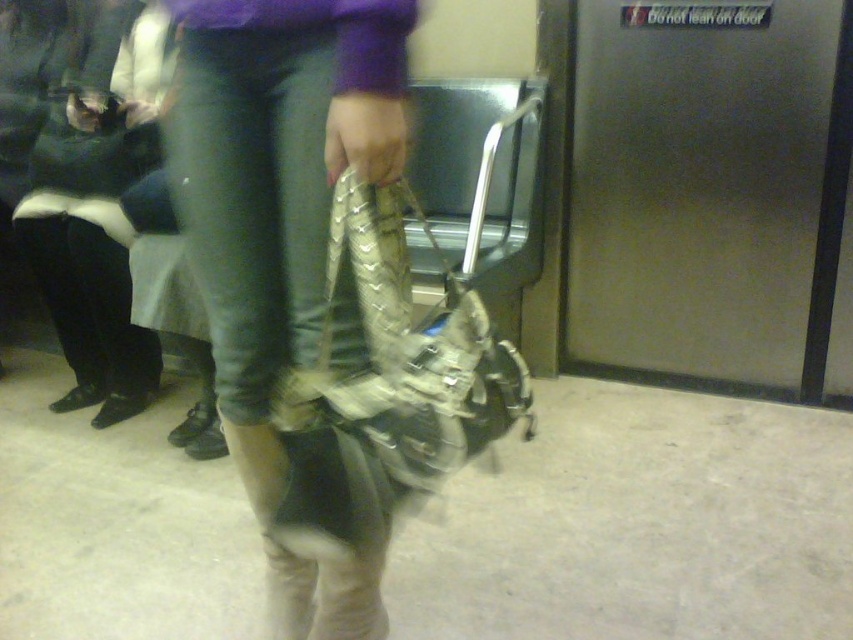
Question: Does leather boots at center have a greater width compared to leather-like metallic bag at center?

Choices:
 (A) yes
 (B) no

Answer: (B)

Question: Can you confirm if leather boots at center is positioned to the left of leather-like metallic bag at center?

Choices:
 (A) yes
 (B) no

Answer: (A)

Question: Which point is closer to the camera taking this photo?

Choices:
 (A) (317, 509)
 (B) (178, 170)

Answer: (A)

Question: Is leather boots at center positioned in front of leather-like metallic bag at center?

Choices:
 (A) no
 (B) yes

Answer: (B)